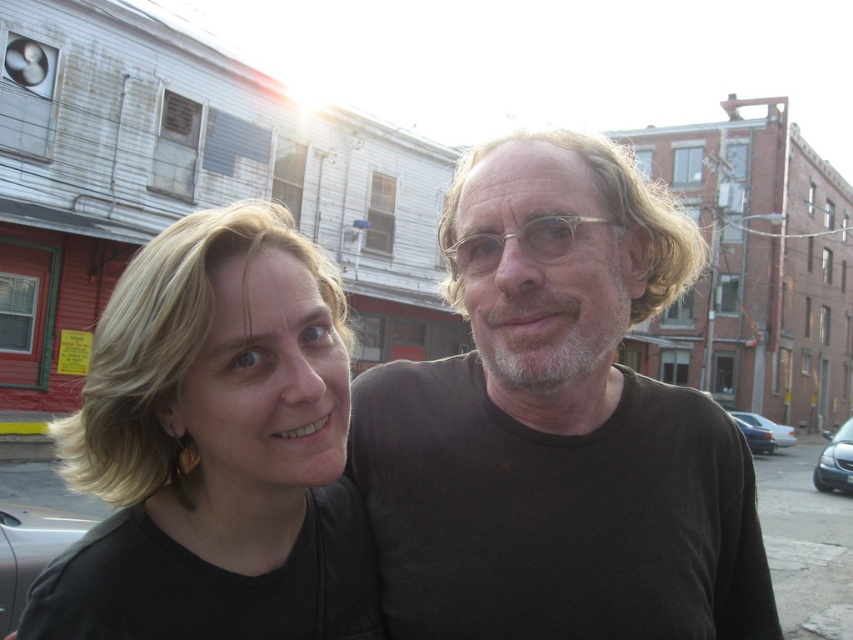
Is metallic silver sedan at lower right thinner than matte black sedan at right?

No.

Find the location of `metallic silver sedan at lower right`. metallic silver sedan at lower right is located at coordinates (834, 461).

Does point (831, 477) come closer to viewer compared to point (776, 435)?

Yes.

Where is `metallic silver sedan at lower right`? metallic silver sedan at lower right is located at coordinates (834, 461).

Who is lower down, black matte shirt at center or metallic silver sedan at lower right?

metallic silver sedan at lower right is lower down.

In the scene shown: Which of these two, black matte shirt at center or metallic silver sedan at lower right, stands taller?

metallic silver sedan at lower right is taller.

Locate an element on the screen. The image size is (853, 640). black matte shirt at center is located at coordinates (556, 424).

In the scene shown: Between black matte shirt at center and matte black sedan at right, which one has more height?

With more height is matte black sedan at right.

Can you confirm if black matte shirt at center is positioned below matte black sedan at right?

No, black matte shirt at center is not below matte black sedan at right.

Who is more forward, (619, 472) or (741, 412)?

Point (619, 472)

Image resolution: width=853 pixels, height=640 pixels. I want to click on black matte shirt at center, so click(556, 424).